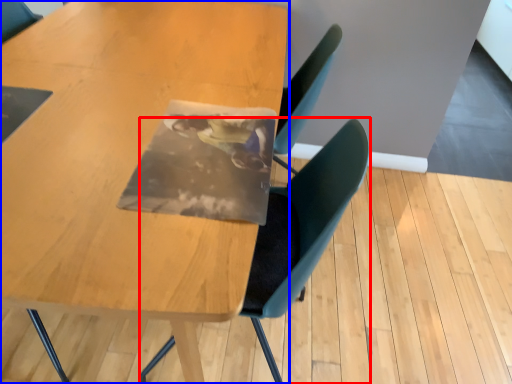
Question: Which object appears closest to the camera in this image, chair (highlighted by a red box) or table (highlighted by a blue box)?

Choices:
 (A) chair
 (B) table

Answer: (B)